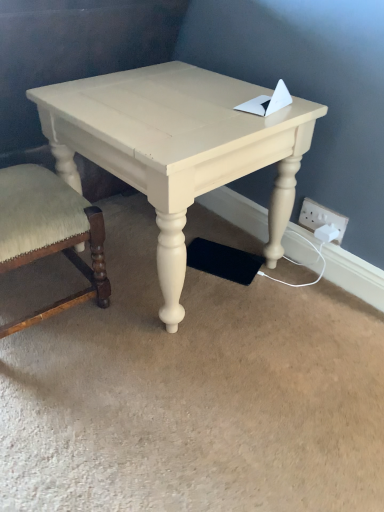
Question: Looking at their shapes, would you say velvet beige chair at lower left is wider or thinner than white plastic electric outlet at lower right?

Choices:
 (A) thin
 (B) wide

Answer: (B)

Question: Choose the correct answer: Is velvet beige chair at lower left inside white plastic electric outlet at lower right or outside it?

Choices:
 (A) outside
 (B) inside

Answer: (A)

Question: Which object is the farthest from the velvet beige chair at lower left?

Choices:
 (A) white plastic electric outlet at lower right
 (B) matte cream table at center

Answer: (A)

Question: Based on their relative distances, which object is farther from the velvet beige chair at lower left?

Choices:
 (A) white plastic electric outlet at lower right
 (B) matte cream table at center

Answer: (A)